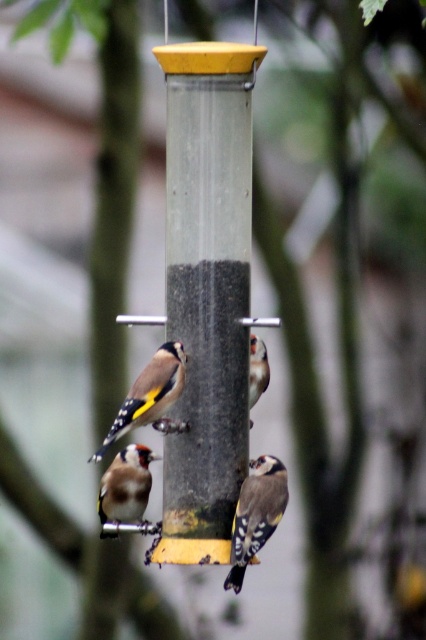
Which is above, yellow and black speckled bird at center or brown speckled feathers at lower left?

Result: brown speckled feathers at lower left

Is point (241, 486) closer to viewer compared to point (141, 451)?

Yes.

The width and height of the screenshot is (426, 640). I want to click on yellow and black speckled bird at center, so click(256, 515).

Which is more to the left, brown speckled feathers at lower left or brown speckled feathers at center?

brown speckled feathers at lower left

Is brown speckled feathers at lower left shorter than brown speckled feathers at center?

No.

Who is more forward, (134, 461) or (252, 336)?

Point (252, 336)

Where is `brown speckled feathers at lower left`? The height and width of the screenshot is (640, 426). brown speckled feathers at lower left is located at coordinates (126, 490).

Is golden-yellow feathers at center further to the viewer compared to brown speckled feathers at center?

No, golden-yellow feathers at center is closer to the viewer.

Does golden-yellow feathers at center appear over brown speckled feathers at center?

No.

Which is in front, point (170, 355) or point (255, 349)?

Point (170, 355)

Locate an element on the screen. golden-yellow feathers at center is located at coordinates (149, 394).